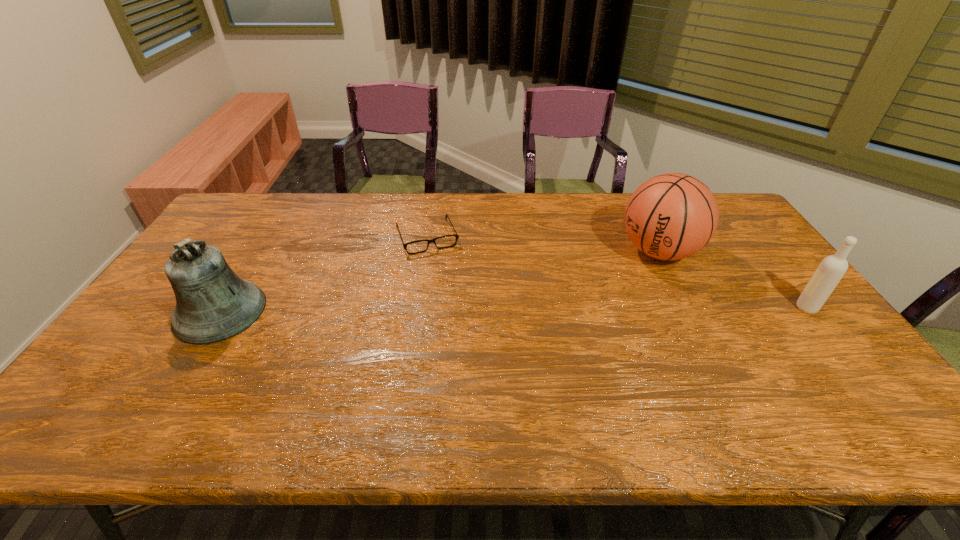
This screenshot has height=540, width=960. Identify the location of blank region between the rightmost object and the third object from right to left. coord(616,272).

You are a GUI agent. You are given a task and a screenshot of the screen. Output one action in this format:
    pyautogui.click(x=<x>, y=<y>)
    Task: Click on the free space between the shortest object and the third object from left to right
    The image size is (960, 540).
    Given the screenshot: What is the action you would take?
    point(543,244)

At what (x,y) coordinates should I click in order to perform the action: click on object that is the second closest to the bell. Please return your answer as a coordinate pair (x, y). The image size is (960, 540). Looking at the image, I should click on (671, 216).

Select which object is the closest to the bell. Please provide its 2D coordinates. Your answer should be formatted as a tuple, i.e. [(x, y)], where the tuple contains the x and y coordinates of a point satisfying the conditions above.

[(456, 235)]

Where is `free location that satisfies the following two spatial constraints: 1. on the front side of the third object from left to right; 2. on the left side of the shortest object`? This screenshot has height=540, width=960. free location that satisfies the following two spatial constraints: 1. on the front side of the third object from left to right; 2. on the left side of the shortest object is located at coordinates (424, 251).

The height and width of the screenshot is (540, 960). In order to click on vacant region that satisfies the following two spatial constraints: 1. on the front side of the rightmost object; 2. on the left side of the second object from right to left in this screenshot , I will do `click(687, 308)`.